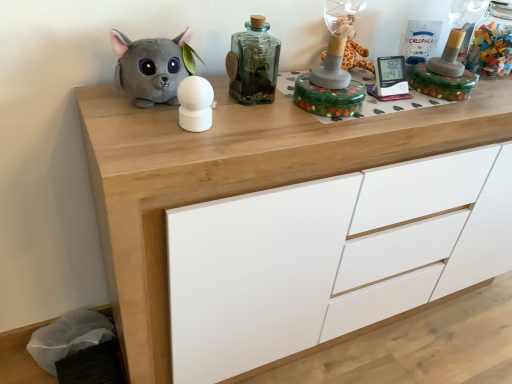
The height and width of the screenshot is (384, 512). I want to click on free space in front of gray plush toy at left, the third toy in the right-to-left sequence, so click(150, 135).